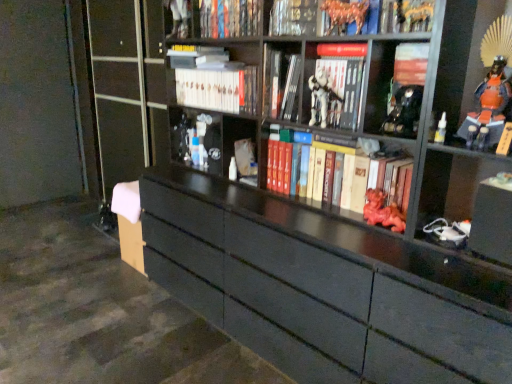
Where is `hardcover book at center, which appears as the 8th book when viewed from the top`? This screenshot has height=384, width=512. hardcover book at center, which appears as the 8th book when viewed from the top is located at coordinates (336, 170).

Where is `translucent plastic bottle at upper right, positioned as the 6th toy in left-to-right order`? translucent plastic bottle at upper right, positioned as the 6th toy in left-to-right order is located at coordinates (441, 129).

What do you see at coordinates (441, 129) in the screenshot? This screenshot has width=512, height=384. I see `translucent plastic bottle at upper right, positioned as the 6th toy in left-to-right order` at bounding box center [441, 129].

Locate an element on the screen. This screenshot has height=384, width=512. hardcover book at upper center, marked as the 8th book in a bottom-to-top arrangement is located at coordinates (230, 18).

Is metallic gold horse at upper center, the 4th toy viewed from the right, facing towards white plastic spray bottle at center, acting as the second toy starting from the left?

No, metallic gold horse at upper center, the 4th toy viewed from the right, is not facing towards white plastic spray bottle at center, acting as the second toy starting from the left.

Is metallic gold horse at upper center, the 4th toy viewed from the right, not within white plastic spray bottle at center, the fifth toy when ordered from right to left?

Absolutely, metallic gold horse at upper center, the 4th toy viewed from the right, is external to white plastic spray bottle at center, the fifth toy when ordered from right to left.

Considering the positions of objects metallic gold horse at upper center, the 4th toy viewed from the back, and white plastic spray bottle at center, the fifth toy when ordered from right to left, in the image provided, who is more to the left, metallic gold horse at upper center, the 4th toy viewed from the back, or white plastic spray bottle at center, the fifth toy when ordered from right to left,?

white plastic spray bottle at center, the fifth toy when ordered from right to left, is more to the left.

Could you tell me if matte black bookcase at center is turned towards hardcover book at upper center, marked as the 8th book in a bottom-to-top arrangement?

No, matte black bookcase at center is not facing towards hardcover book at upper center, marked as the 8th book in a bottom-to-top arrangement.

Is matte black bookcase at center in front of or behind hardcover book at upper center, marked as the 8th book in a bottom-to-top arrangement, in the image?

matte black bookcase at center is positioned closer to the viewer than hardcover book at upper center, marked as the 8th book in a bottom-to-top arrangement.

Does matte black bookcase at center touch hardcover book at upper center, marked as the 8th book in a bottom-to-top arrangement?

No, matte black bookcase at center is not making contact with hardcover book at upper center, marked as the 8th book in a bottom-to-top arrangement.

Considering the sizes of matte black bookcase at center and hardcover book at upper center, the first book in the top-to-bottom sequence, in the image, is matte black bookcase at center taller or shorter than hardcover book at upper center, the first book in the top-to-bottom sequence,?

Clearly, matte black bookcase at center is taller compared to hardcover book at upper center, the first book in the top-to-bottom sequence.

Could you tell me if metallic black figurine at center, the sixth toy when ordered from right to left, is turned towards metallic black helmet at upper right, marked as the 7th book in a top-to-bottom arrangement?

No, metallic black figurine at center, the sixth toy when ordered from right to left, is not aimed at metallic black helmet at upper right, marked as the 7th book in a top-to-bottom arrangement.

Looking at this image, considering the relative sizes of metallic black figurine at center, marked as the first toy in a left-to-right arrangement, and metallic black helmet at upper right, which appears as the 2th book when ordered from the bottom, in the image provided, is metallic black figurine at center, marked as the first toy in a left-to-right arrangement, thinner than metallic black helmet at upper right, which appears as the 2th book when ordered from the bottom,?

Yes, metallic black figurine at center, marked as the first toy in a left-to-right arrangement, is thinner than metallic black helmet at upper right, which appears as the 2th book when ordered from the bottom.

Can you confirm if metallic black figurine at center, which is counted as the sixth toy, starting from the front, is bigger than metallic black helmet at upper right, which appears as the 2th book when ordered from the bottom?

Actually, metallic black figurine at center, which is counted as the sixth toy, starting from the front, might be smaller than metallic black helmet at upper right, which appears as the 2th book when ordered from the bottom.

Is point (181, 122) positioned after point (402, 59)?

Yes, point (181, 122) is behind point (402, 59).

Can you confirm if orange glossy samurai armor at upper right is positioned to the left of metallic black helmet at upper right, which appears as the 2th book when ordered from the bottom?

No, orange glossy samurai armor at upper right is not to the left of metallic black helmet at upper right, which appears as the 2th book when ordered from the bottom.

How different are the orientations of orange glossy samurai armor at upper right and metallic black helmet at upper right, marked as the 7th book in a top-to-bottom arrangement, in degrees?

orange glossy samurai armor at upper right and metallic black helmet at upper right, marked as the 7th book in a top-to-bottom arrangement, are facing 0.00206 degrees away from each other.

From the image's perspective, does orange glossy samurai armor at upper right appear lower than metallic black helmet at upper right, which appears as the 2th book when ordered from the bottom?

Correct, orange glossy samurai armor at upper right appears lower than metallic black helmet at upper right, which appears as the 2th book when ordered from the bottom, in the image.

You are a GUI agent. You are given a task and a screenshot of the screen. Output one action in this format:
    pyautogui.click(x=<x>, y=<y>)
    Task: Click on the cabinet in front of the metallic black helmet at upper right, marked as the 7th book in a top-to-bottom arrangement
    This screenshot has width=512, height=384.
    Given the screenshot: What is the action you would take?
    pyautogui.click(x=462, y=59)

Considering the sizes of orange glossy samurai armor at upper right and white glossy book at upper center, positioned as the sixth book in bottom-to-top order, in the image, is orange glossy samurai armor at upper right taller or shorter than white glossy book at upper center, positioned as the sixth book in bottom-to-top order,?

Clearly, orange glossy samurai armor at upper right is taller compared to white glossy book at upper center, positioned as the sixth book in bottom-to-top order.

What's the angular difference between orange glossy samurai armor at upper right and white glossy book at upper center, positioned as the sixth book in bottom-to-top order,'s facing directions?

orange glossy samurai armor at upper right and white glossy book at upper center, positioned as the sixth book in bottom-to-top order, are facing 1.88 degrees away from each other.

Could you tell me if orange glossy samurai armor at upper right is facing white glossy book at upper center, the 3th book in the top-to-bottom sequence?

No, orange glossy samurai armor at upper right is not facing towards white glossy book at upper center, the 3th book in the top-to-bottom sequence.

Which of these two, orange glossy samurai armor at upper right or white glossy book at upper center, the 3th book in the top-to-bottom sequence, is thinner?

Thinner between the two is orange glossy samurai armor at upper right.

Considering the sizes of objects white matte book at center, which appears as the 3th book when ordered from the bottom, and metallic black helmet at upper right, the 5th toy when ordered from left to right, in the image provided, who is smaller, white matte book at center, which appears as the 3th book when ordered from the bottom, or metallic black helmet at upper right, the 5th toy when ordered from left to right,?

With smaller size is metallic black helmet at upper right, the 5th toy when ordered from left to right.

From a real-world perspective, relative to metallic black helmet at upper right, the 2th toy in the right-to-left sequence, is white matte book at center, which appears as the 3th book when ordered from the bottom, vertically above or below?

In terms of real-world spatial position, white matte book at center, which appears as the 3th book when ordered from the bottom, is above metallic black helmet at upper right, the 2th toy in the right-to-left sequence.

Which of these two, white matte book at center, arranged as the sixth book when viewed from the top, or metallic black helmet at upper right, the 5th toy when ordered from left to right, is thinner?

Thinner between the two is metallic black helmet at upper right, the 5th toy when ordered from left to right.

Is white matte book at center, arranged as the sixth book when viewed from the top, facing away from metallic black helmet at upper right, placed as the 1th toy when sorted from front to back?

No.

Which is nearer, (x=370, y=159) or (x=318, y=89)?

Point (x=370, y=159) is closer to the camera than point (x=318, y=89).

Can you tell me how much hardcover book at center, the 1th book from the bottom, and white matte book at center, which appears as the 3th book when ordered from the bottom, differ in facing direction?

0.732 degrees.

Considering the positions of objects hardcover book at center, which appears as the 8th book when viewed from the top, and white matte book at center, which appears as the 3th book when ordered from the bottom, in the image provided, who is in front, hardcover book at center, which appears as the 8th book when viewed from the top, or white matte book at center, which appears as the 3th book when ordered from the bottom,?

hardcover book at center, which appears as the 8th book when viewed from the top, is more forward.

From the image's perspective, is hardcover book at center, which appears as the 8th book when viewed from the top, above white matte book at center, which appears as the 3th book when ordered from the bottom?

No.

Identify the location of toy that is the 5th one below the metallic gold horse at upper center, the 4th toy viewed from the back (from a real-world perspective). (233, 170).

The image size is (512, 384). I want to click on bookcase below the hardcover book at upper center, marked as the 8th book in a bottom-to-top arrangement (from the image's perspective), so click(350, 223).

Looking at the image, which one is located closer to matte red statue at center, acting as the fourth toy starting from the front, white plastic spray bottle at center, the fifth toy viewed from the front, or white glossy book at upper center, positioned as the sixth book in bottom-to-top order?

white plastic spray bottle at center, the fifth toy viewed from the front, is closer to matte red statue at center, acting as the fourth toy starting from the front.

Estimate the real-world distances between objects in this image. Which object is closer to matte red statue at center, acting as the third toy starting from the back, hardcover book at upper center, the 7th book in the bottom-to-top sequence, or metallic black helmet at upper right, marked as the 7th book in a top-to-bottom arrangement?

metallic black helmet at upper right, marked as the 7th book in a top-to-bottom arrangement, lies closer to matte red statue at center, acting as the third toy starting from the back, than the other object.

Looking at the image, which one is located further to matte black bookcase at center, white matte book at center, arranged as the sixth book when viewed from the top, or hardcover book at upper center, the first book in the top-to-bottom sequence?

hardcover book at upper center, the first book in the top-to-bottom sequence, is positioned further to the anchor matte black bookcase at center.

Considering their positions, is white matte book at center, arranged as the sixth book when viewed from the top, positioned closer to metallic gold horse at upper center, the 4th toy viewed from the right, than hardcover book at center, marked as the fourth book in a bottom-to-top arrangement?

Based on the image, white matte book at center, arranged as the sixth book when viewed from the top, appears to be nearer to metallic gold horse at upper center, the 4th toy viewed from the right.

Based on their spatial positions, is metallic black helmet at upper right, arranged as the 6th toy when viewed from the back, or hardcover book at upper center, the first book in the top-to-bottom sequence, closer to matte red statue at center, acting as the third toy starting from the back?

Based on the image, metallic black helmet at upper right, arranged as the 6th toy when viewed from the back, appears to be nearer to matte red statue at center, acting as the third toy starting from the back.

Considering their positions, is white matte book at center, which appears as the 3th book when ordered from the bottom, positioned further to hardcover book at center, the fifth book from the top, than white plastic figure at center?

A: white matte book at center, which appears as the 3th book when ordered from the bottom.

Which object lies nearer to the anchor point white plastic figure at center, orange glossy samurai armor at upper right or hardcover book at upper center, the second book viewed from the top?

hardcover book at upper center, the second book viewed from the top.

In the scene shown: Looking at the image, which one is located closer to matte black bookcase at center, orange glossy samurai armor at upper right or white plastic spray bottle at center, the fifth toy viewed from the front?

orange glossy samurai armor at upper right.

You are a GUI agent. You are given a task and a screenshot of the screen. Output one action in this format:
    pyautogui.click(x=<x>, y=<y>)
    Task: Click on the comic book character between metallic black helmet at upper right, which appears as the 2th book when ordered from the bottom, and white plastic spray bottle at center, the fifth toy when ordered from right to left, from front to back
    This screenshot has height=384, width=512.
    Given the screenshot: What is the action you would take?
    pyautogui.click(x=321, y=97)

Find the location of a particular element. The height and width of the screenshot is (384, 512). comic book character between hardcover book at upper center, the 7th book in the bottom-to-top sequence, and translucent plastic bottle at upper right, the first toy viewed from the right, in the up-down direction is located at coordinates (321, 97).

Locate an element on the screen. comic book character between white glossy book at upper center, positioned as the sixth book in bottom-to-top order, and white matte book at center, which appears as the 3th book when ordered from the bottom is located at coordinates click(x=321, y=97).

Identify the location of toy between matte black bookcase at center and translucent plastic bottle at upper right, the first toy viewed from the right, from front to back. (404, 112).